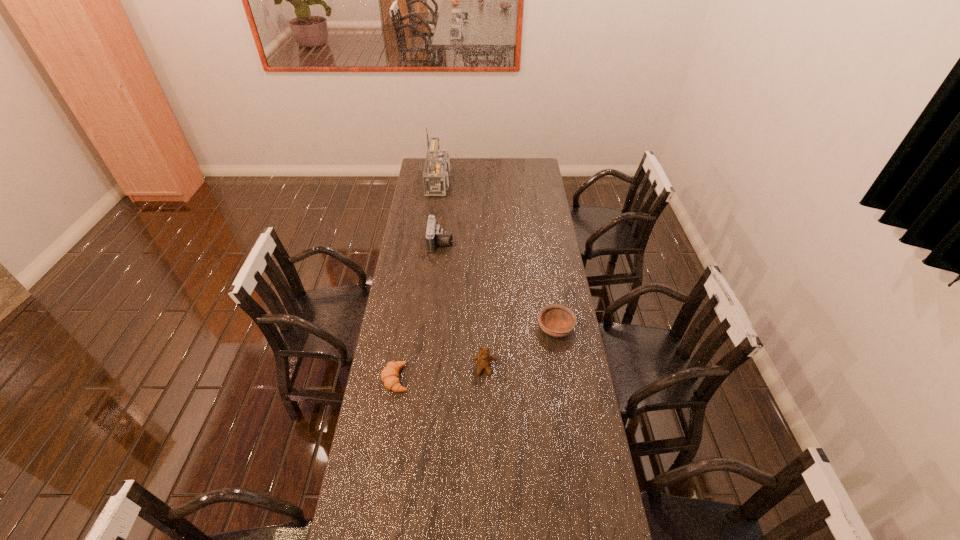
You are a GUI agent. You are given a task and a screenshot of the screen. Output one action in this format:
    pyautogui.click(x=<x>, y=<y>)
    Task: Click on the tallest object
    
    Given the screenshot: What is the action you would take?
    pyautogui.click(x=436, y=172)

In order to click on the farthest object in this screenshot , I will do `click(436, 172)`.

At what (x,y) coordinates should I click in order to perform the action: click on camera. Please return your answer as a coordinate pair (x, y). The image size is (960, 540). Looking at the image, I should click on (x=435, y=236).

This screenshot has width=960, height=540. Find the location of `teddy bear`. teddy bear is located at coordinates (484, 360).

Locate an element on the screen. Image resolution: width=960 pixels, height=540 pixels. the rightmost object is located at coordinates (556, 320).

At what (x,y) coordinates should I click in order to perform the action: click on bowl. Please return your answer as a coordinate pair (x, y). Looking at the image, I should click on (556, 320).

Where is `crescent roll`? This screenshot has height=540, width=960. crescent roll is located at coordinates (389, 375).

This screenshot has height=540, width=960. In order to click on free space located 0.280m on the front-facing side of the radio receiver in this screenshot , I will do `click(507, 183)`.

Where is `blank space located at the front of the fourth nearest object with an open lens cover`? Image resolution: width=960 pixels, height=540 pixels. blank space located at the front of the fourth nearest object with an open lens cover is located at coordinates (492, 242).

Find the location of a particular element. vacant area situated on the front-facing side of the fourth object from left to right is located at coordinates (485, 434).